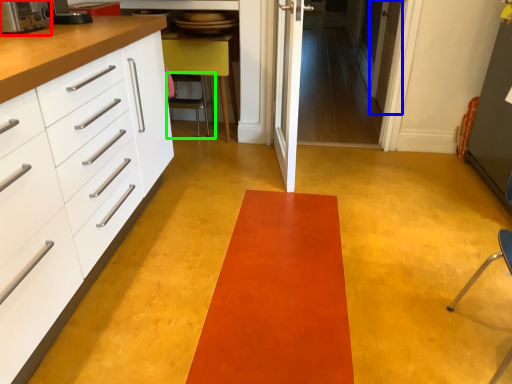
Question: Which object is positioned farthest from appliance (highlighted by a red box)? Select from door (highlighted by a blue box) and chair (highlighted by a green box).

Choices:
 (A) door
 (B) chair

Answer: (A)